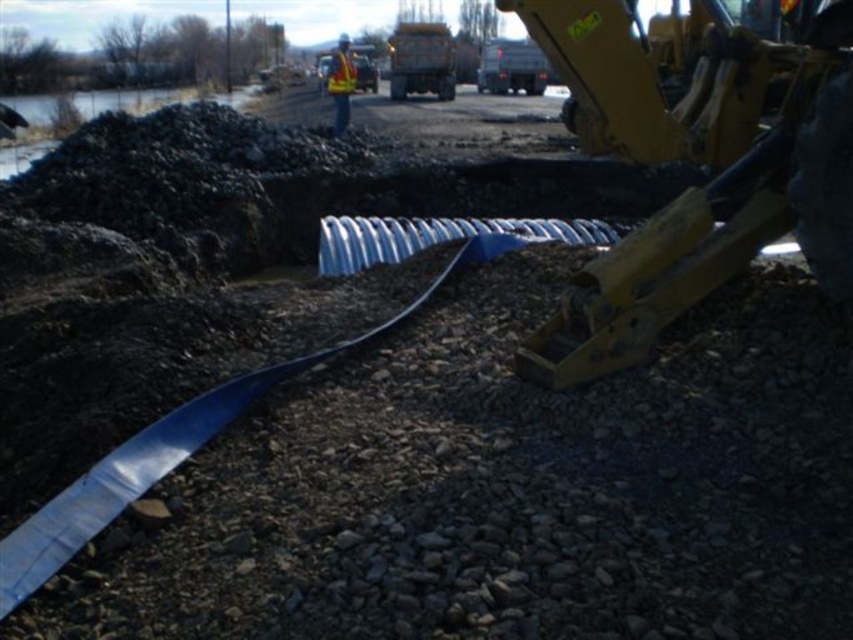
Consider the image. Is gray gravel at center above yellow metallic excavator at center right?

Actually, gray gravel at center is below yellow metallic excavator at center right.

Is gray gravel at center wider than yellow metallic excavator at center right?

Correct, the width of gray gravel at center exceeds that of yellow metallic excavator at center right.

Locate an element on the screen. The height and width of the screenshot is (640, 853). gray gravel at center is located at coordinates (506, 486).

Can you confirm if yellow metallic excavator at center right is shorter than yellow reflective vest at center?

Yes, yellow metallic excavator at center right is shorter than yellow reflective vest at center.

Does yellow metallic excavator at center right appear under yellow reflective vest at center?

Yes, yellow metallic excavator at center right is below yellow reflective vest at center.

Who is more distant from viewer, (635, 340) or (344, 131)?

Positioned behind is point (344, 131).

The image size is (853, 640). In order to click on yellow metallic excavator at center right in this screenshot , I will do `click(695, 161)`.

Does point (113, 579) lie in front of point (329, 83)?

Yes, it is.

Where is `gray gravel at center`? gray gravel at center is located at coordinates (506, 486).